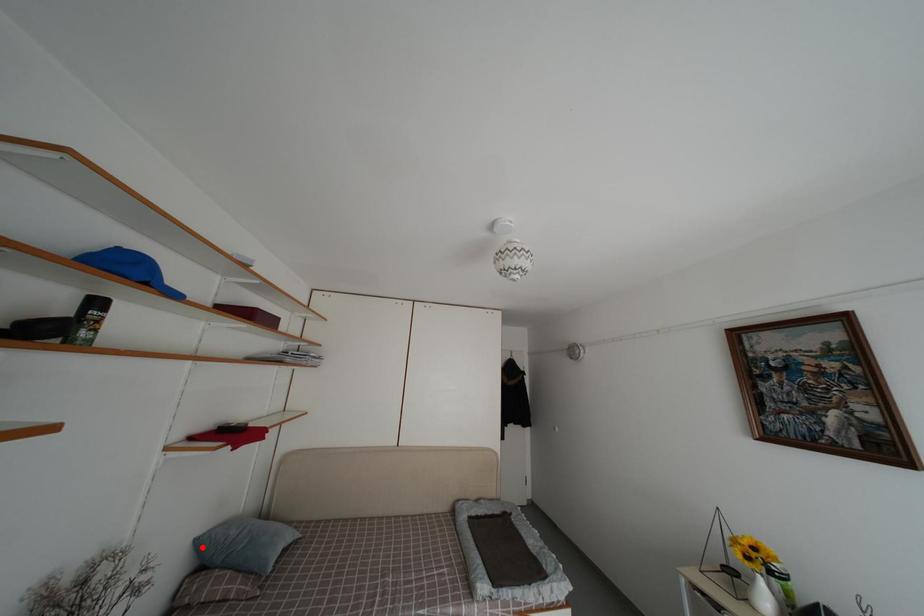
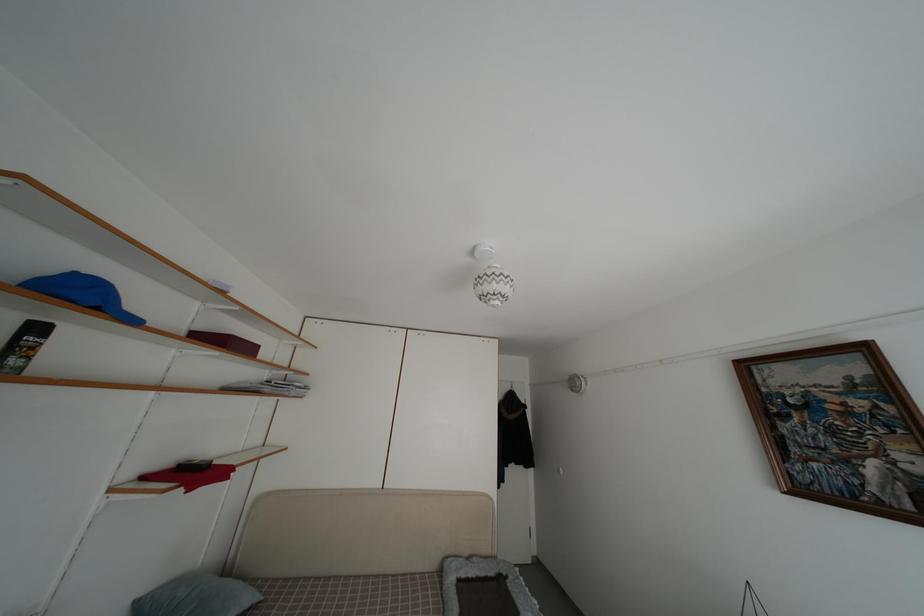
Where in the second image is the point corresponding to the highlighted location from the first image?

(142, 610)